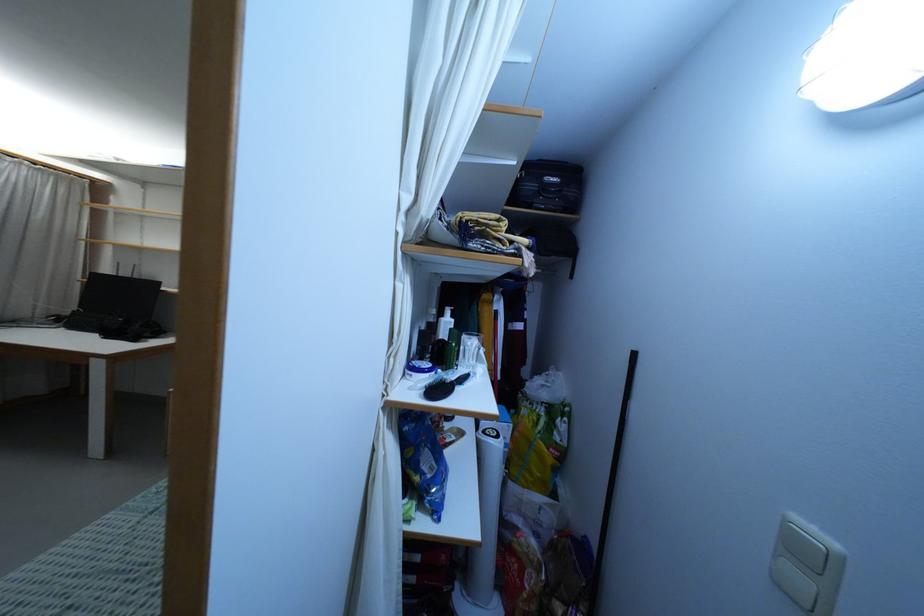
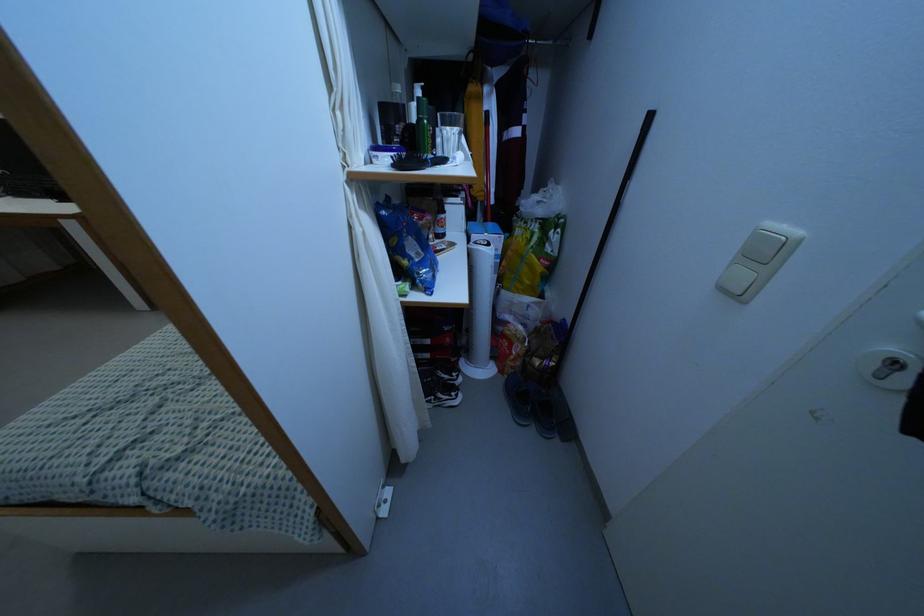
Locate, in the second image, the point that corresponds to (799,580) in the first image.

(743, 276)